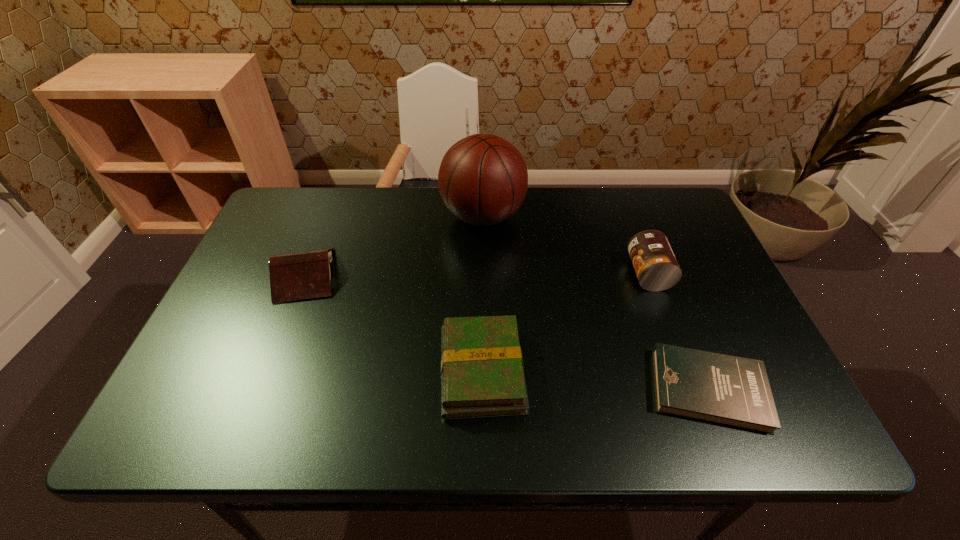
In the image, there is a desktop. At what (x,y) coordinates should I click in order to perform the action: click on vacant space at the far edge. Please return your answer as a coordinate pair (x, y). The width and height of the screenshot is (960, 540). Looking at the image, I should click on (621, 228).

Image resolution: width=960 pixels, height=540 pixels. Identify the location of vacant space at the near edge of the desktop. (372, 407).

Where is `vacant space at the left edge`? vacant space at the left edge is located at coordinates (250, 254).

At what (x,y) coordinates should I click in order to perform the action: click on free spot at the right edge of the desktop. Please return your answer as a coordinate pair (x, y). Looking at the image, I should click on (685, 329).

In the image, there is a desktop. Identify the location of free space at the far left corner. This screenshot has width=960, height=540. (297, 198).

I want to click on vacant space at the far right corner of the desktop, so click(x=697, y=232).

What are the coordinates of `vacant area between the second book from left to right and the basketball` in the screenshot? It's located at (482, 293).

Identify the location of empty space between the farthest object and the second book from right to left. (482, 293).

This screenshot has width=960, height=540. I want to click on vacant area that lies between the shortest book and the second book from left to right, so click(595, 380).

Identify the location of free space that is in between the basketball and the second book from left to right. This screenshot has width=960, height=540. (482, 293).